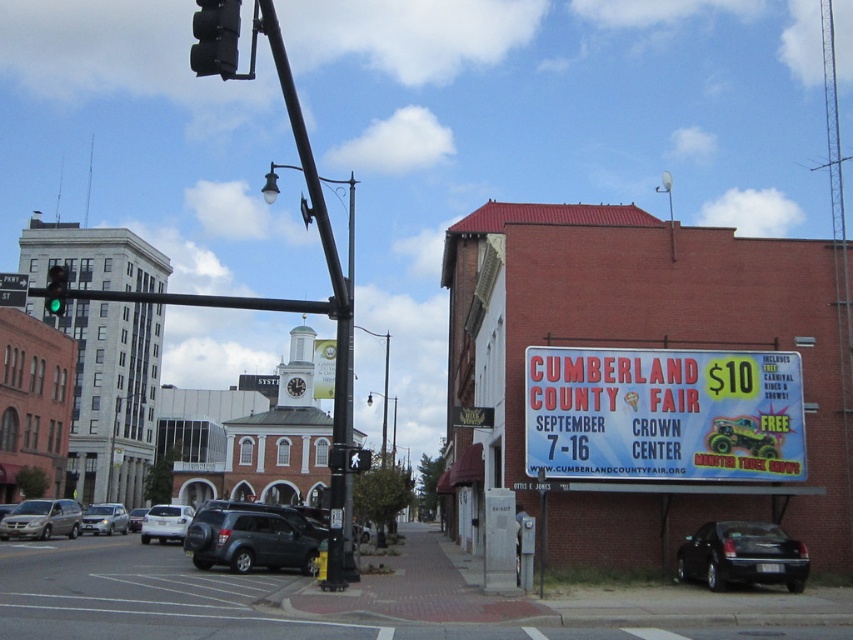
Is black metal pole at upper center wider than white matte sedan at center?

Indeed, black metal pole at upper center has a greater width compared to white matte sedan at center.

Who is more distant from viewer, [350,564] or [148,529]?

Positioned behind is point [148,529].

What do you see at coordinates (328, 308) in the screenshot? Image resolution: width=853 pixels, height=640 pixels. I see `black metal pole at upper center` at bounding box center [328, 308].

Locate an element on the screen. The image size is (853, 640). black metal pole at upper center is located at coordinates (328, 308).

Is silver metallic minivan at lower left above silver metallic suv at center?

Correct, silver metallic minivan at lower left is located above silver metallic suv at center.

Does silver metallic minivan at lower left appear on the left side of silver metallic suv at center?

No, silver metallic minivan at lower left is not to the left of silver metallic suv at center.

Image resolution: width=853 pixels, height=640 pixels. Find the location of `silver metallic minivan at lower left`. silver metallic minivan at lower left is located at coordinates (41, 518).

Does white matte sedan at center have a smaller size compared to green glass traffic light at upper left?

Indeed, white matte sedan at center has a smaller size compared to green glass traffic light at upper left.

Is point (154, 529) closer to camera compared to point (61, 275)?

No.

Between point (157, 516) and point (44, 300), which one is positioned in front?

Point (157, 516) is in front.

This screenshot has width=853, height=640. In order to click on white matte sedan at center in this screenshot , I will do `click(165, 522)`.